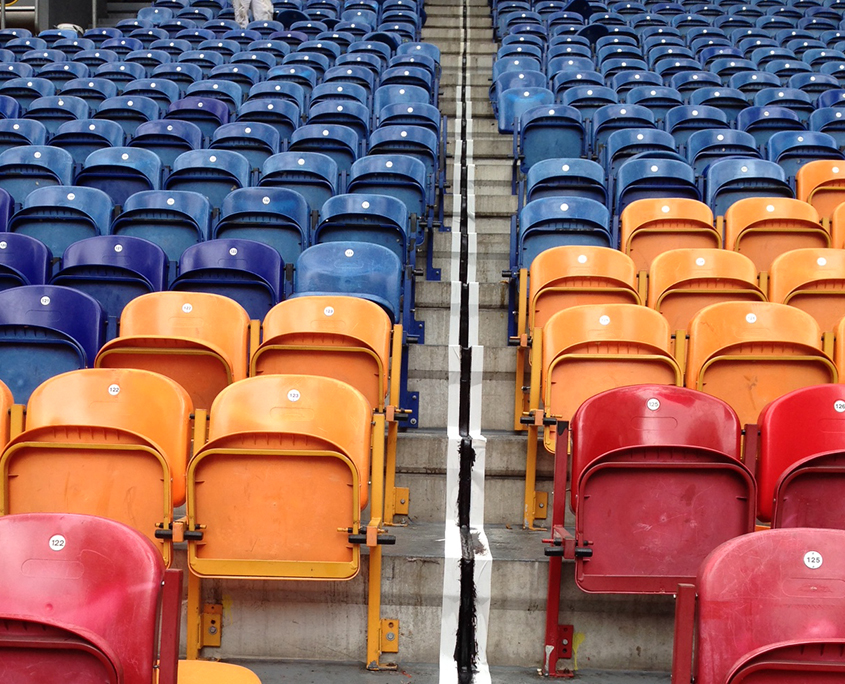
At what (x,y) coordinates should I click in order to perform the action: click on red seats. Please return your answer as a coordinate pair (x, y). Looking at the image, I should click on (74, 592), (688, 457), (800, 440), (764, 624).